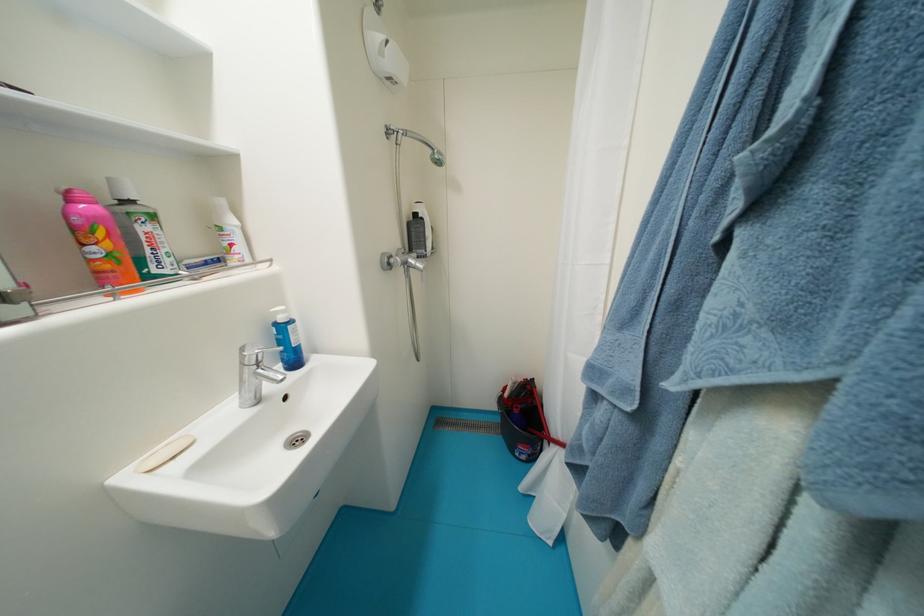
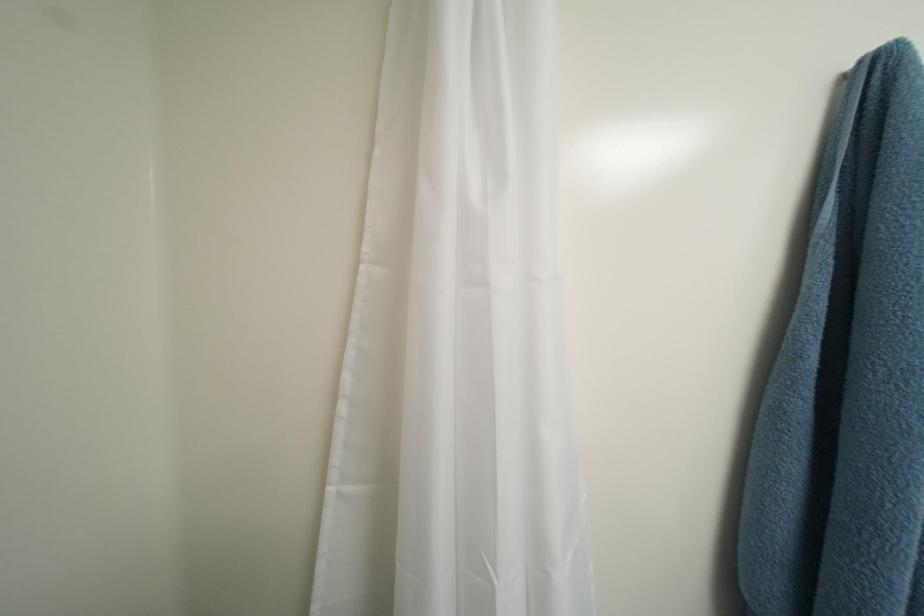
Question: How did the camera likely rotate?

Choices:
 (A) Left
 (B) Right
 (C) Up
 (D) Down

Answer: (B)